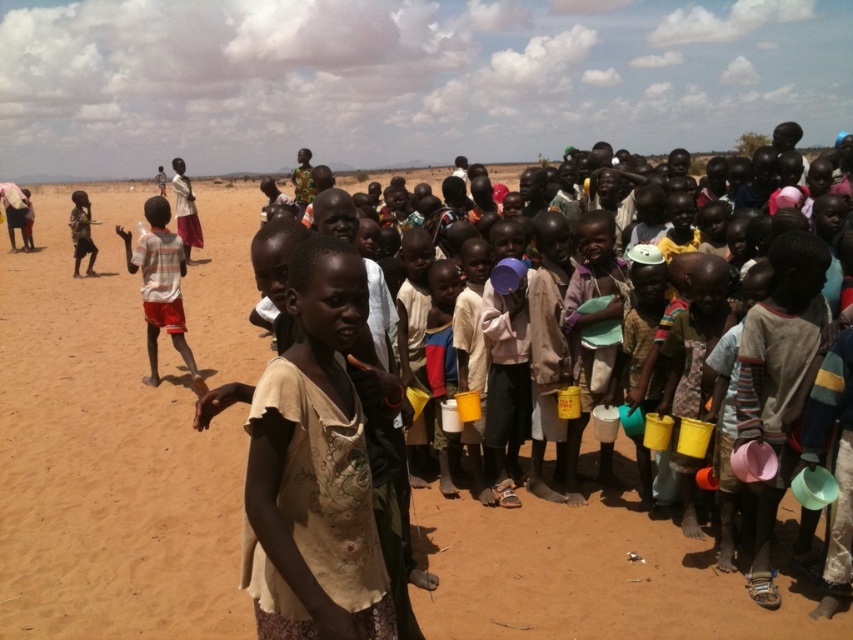
Question: In this image, where is striped cotton shirt at left located relative to dark skin child at left?

Choices:
 (A) below
 (B) above

Answer: (A)

Question: In this image, where is striped cotton shirt at left located relative to dark skin child at left?

Choices:
 (A) left
 (B) right

Answer: (B)

Question: Observing the image, what is the correct spatial positioning of striped cotton shirt at left in reference to dark skin child at left?

Choices:
 (A) above
 (B) below

Answer: (B)